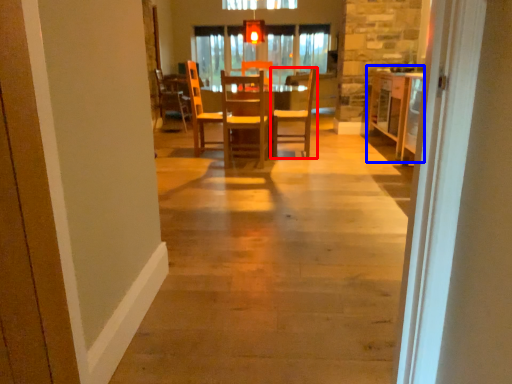
Question: Which object appears closest to the camera in this image, chair (highlighted by a red box) or table (highlighted by a blue box)?

Choices:
 (A) chair
 (B) table

Answer: (B)